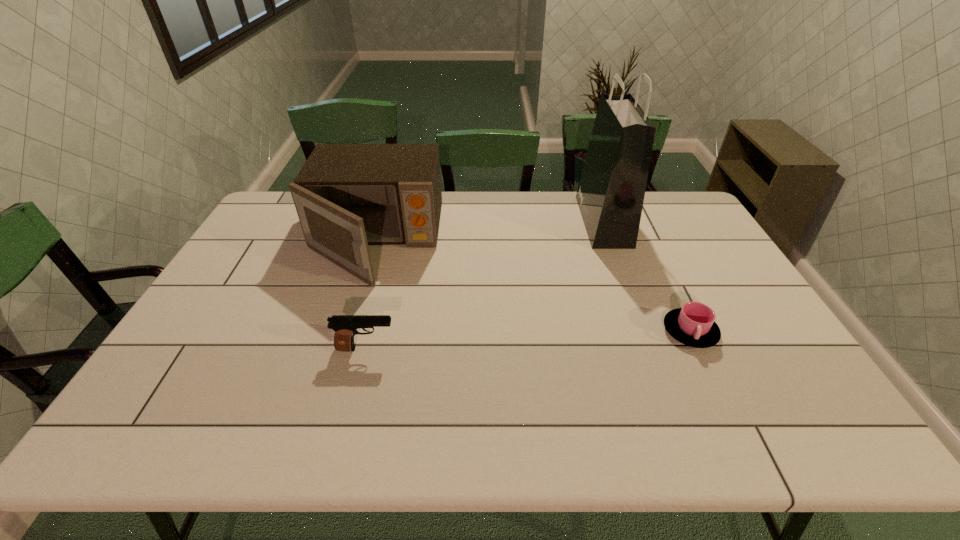
In order to click on vacant space in between the third shortest object and the pistol in this screenshot , I will do `click(371, 295)`.

Locate an element on the screen. The width and height of the screenshot is (960, 540). unoccupied area between the pistol and the tallest object is located at coordinates (485, 285).

Identify the location of vacant space that is in between the tallest object and the cup. click(647, 276).

Locate an element on the screen. This screenshot has width=960, height=540. vacant area that lies between the shopping bag and the pistol is located at coordinates (485, 285).

You are a GUI agent. You are given a task and a screenshot of the screen. Output one action in this format:
    pyautogui.click(x=<x>, y=<y>)
    Task: Click on the empty space between the tallest object and the cup
    
    Given the screenshot: What is the action you would take?
    pyautogui.click(x=647, y=276)

You are a GUI agent. You are given a task and a screenshot of the screen. Output one action in this format:
    pyautogui.click(x=<x>, y=<y>)
    Task: Click on the free space between the tallest object and the second shortest object
    
    Given the screenshot: What is the action you would take?
    pyautogui.click(x=485, y=285)

You are a GUI agent. You are given a task and a screenshot of the screen. Output one action in this format:
    pyautogui.click(x=<x>, y=<y>)
    Task: Click on the vacant space in between the microwave oven and the shopping bag
    
    Given the screenshot: What is the action you would take?
    pyautogui.click(x=489, y=231)

This screenshot has width=960, height=540. I want to click on vacant region between the second shortest object and the microwave oven, so click(x=371, y=295).

Identify which object is located as the third nearest to the shortest object. Please provide its 2D coordinates. Your answer should be formatted as a tuple, i.e. [(x, y)], where the tuple contains the x and y coordinates of a point satisfying the conditions above.

[(345, 326)]

Choose which object is the nearest neighbor to the third tallest object. Please provide its 2D coordinates. Your answer should be formatted as a tuple, i.e. [(x, y)], where the tuple contains the x and y coordinates of a point satisfying the conditions above.

[(347, 196)]